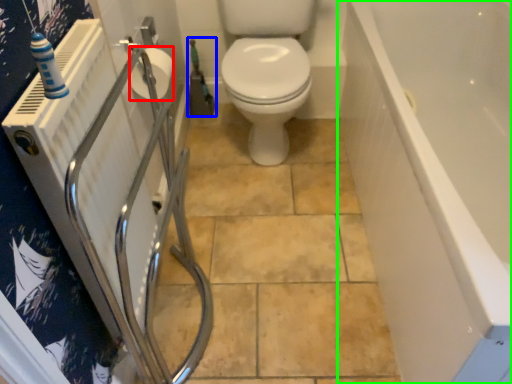
Question: Which object is the farthest from toilet paper (highlighted by a red box)? Choose among these: garden hose (highlighted by a blue box) or bath (highlighted by a green box).

Choices:
 (A) garden hose
 (B) bath

Answer: (B)